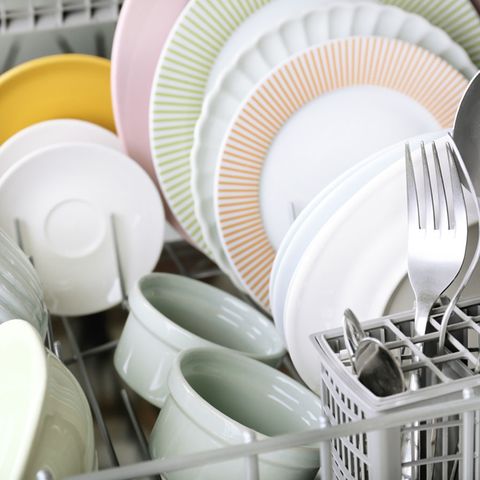
This screenshot has height=480, width=480. Identify the location of pieces of flatware. (431, 235), (472, 193), (373, 360), (349, 325), (469, 129).